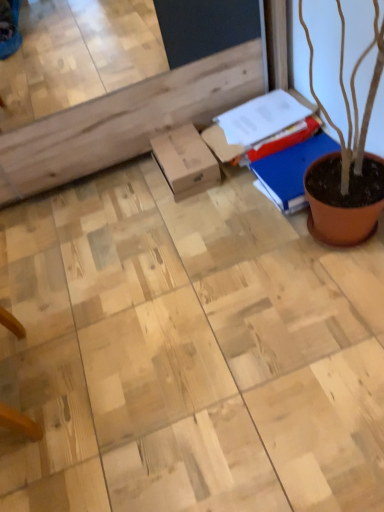
Question: Considering the positions of blue matte book at upper right and cardboard box at center in the image, is blue matte book at upper right taller or shorter than cardboard box at center?

Choices:
 (A) tall
 (B) short

Answer: (A)

Question: Relative to cardboard box at center, is blue matte book at upper right in front or behind?

Choices:
 (A) behind
 (B) front

Answer: (B)

Question: Considering the real-world distances, which object is farthest from the blue matte notebook at right?

Choices:
 (A) cardboard box at center
 (B) blue matte book at upper right

Answer: (A)

Question: Which of these objects is positioned closest to the cardboard box at center?

Choices:
 (A) blue matte book at upper right
 (B) blue matte notebook at right

Answer: (A)